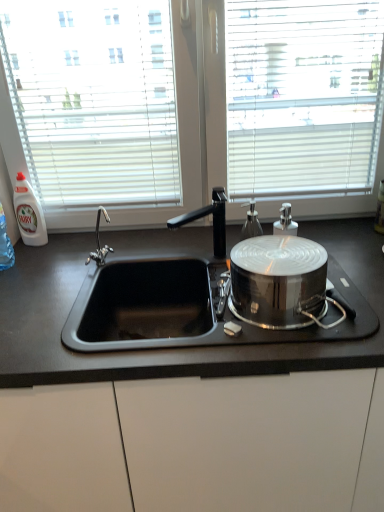
Locate an element on the screen. The width and height of the screenshot is (384, 512). free spot above black matte countertop at center (from a real-world perspective) is located at coordinates (156, 251).